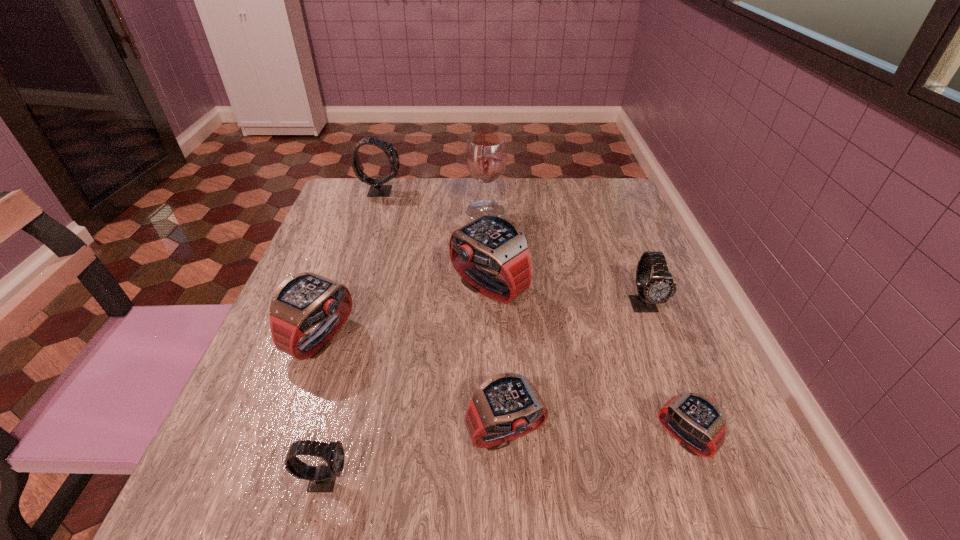
The width and height of the screenshot is (960, 540). I want to click on red watch that is the third closest to the biggest red watch, so click(x=695, y=421).

Find the location of a particular element. The image size is (960, 540). vacant space that satisfies the following two spatial constraints: 1. on the face of the farthest object; 2. on the back side of the rightmost red watch is located at coordinates [299, 438].

Locate an element on the screen. free region that satisfies the following two spatial constraints: 1. on the face of the second smallest gray watch; 2. on the face of the smallest gray watch is located at coordinates (714, 478).

Identify the location of vacant point that satisfies the following two spatial constraints: 1. on the face of the farthest watch; 2. on the front side of the second biggest red watch. (331, 338).

This screenshot has height=540, width=960. I want to click on free space that satisfies the following two spatial constraints: 1. on the face of the farthest gray watch; 2. on the right side of the smallest red watch, so click(299, 438).